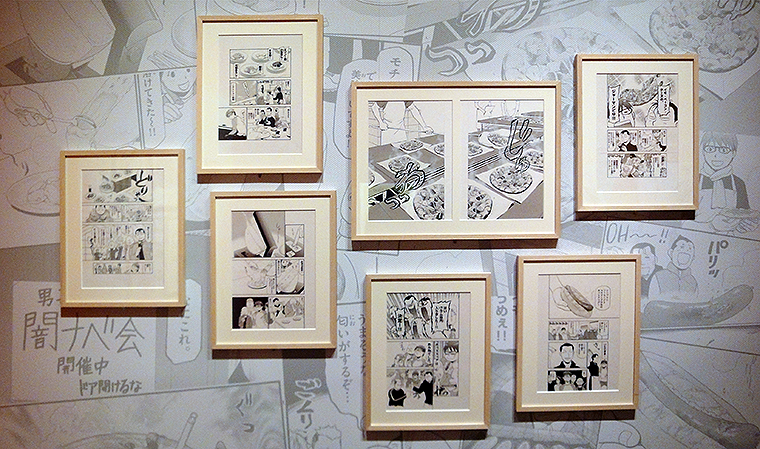
Find the location of a particular element. pictures is located at coordinates (578, 322), (419, 331), (290, 282), (128, 238), (264, 115), (416, 142), (647, 127).